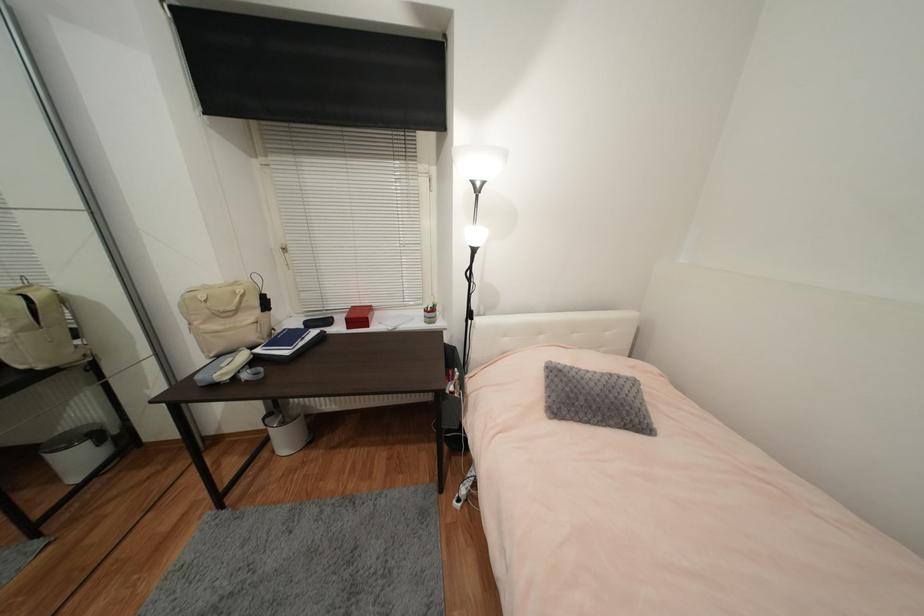
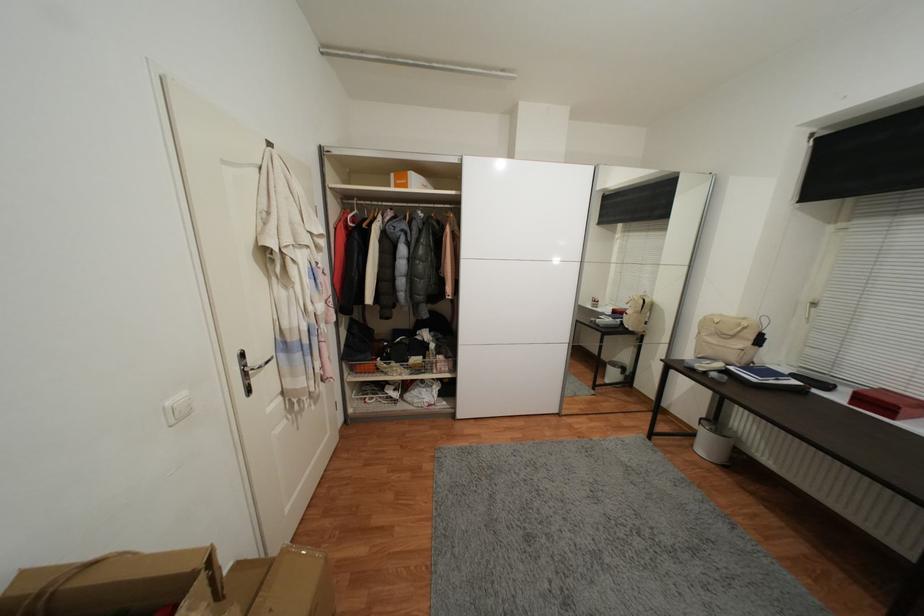
Where in the second image is the point corresponding to (x=240, y=285) from the first image?

(748, 321)